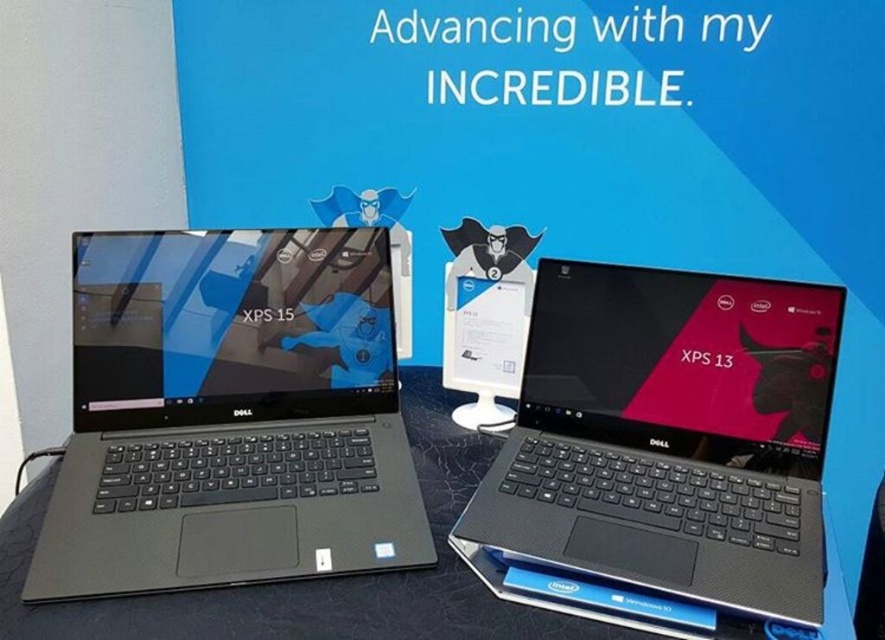
Does matte black laptop at left have a greater height compared to matte black laptop at center?

Yes, matte black laptop at left is taller than matte black laptop at center.

Is matte black laptop at left closer to the viewer compared to matte black laptop at center?

No, it is not.

Which is in front, point (114, 461) or point (541, 458)?

Point (114, 461) is more forward.

Where is `matte black laptop at left`? The image size is (885, 640). matte black laptop at left is located at coordinates (229, 413).

Does matte black laptop at left appear on the right side of black matte table at center?

No, matte black laptop at left is not to the right of black matte table at center.

Between matte black laptop at left and black matte table at center, which one is positioned higher?

matte black laptop at left is higher up.

Where is `matte black laptop at left`? The image size is (885, 640). matte black laptop at left is located at coordinates (229, 413).

Describe the element at coordinates (668, 436) in the screenshot. The image size is (885, 640). I see `matte black laptop at center` at that location.

In the scene shown: Is the position of matte black laptop at center less distant than that of black matte table at center?

No, it is not.

Between point (602, 316) and point (314, 620), which one is positioned in front?

Point (314, 620) is in front.

The width and height of the screenshot is (885, 640). What are the coordinates of `matte black laptop at center` in the screenshot? It's located at (668, 436).